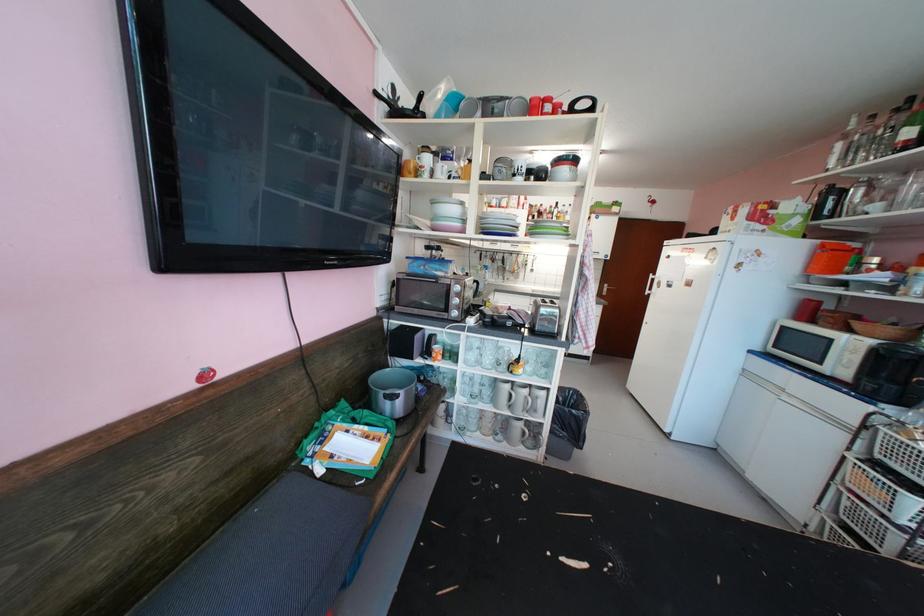
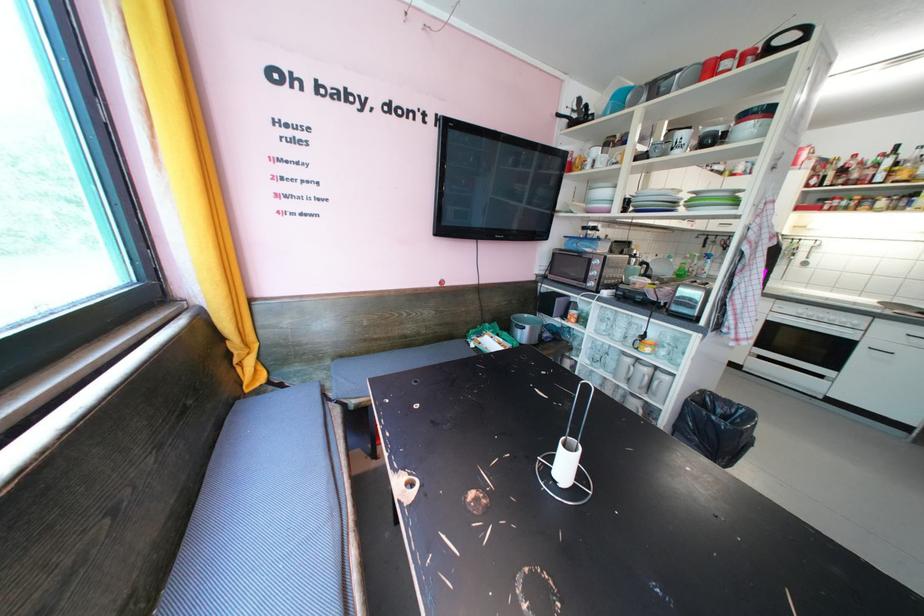
Locate, in the second image, the point that corresponds to (x=456, y=395) in the first image.

(582, 354)